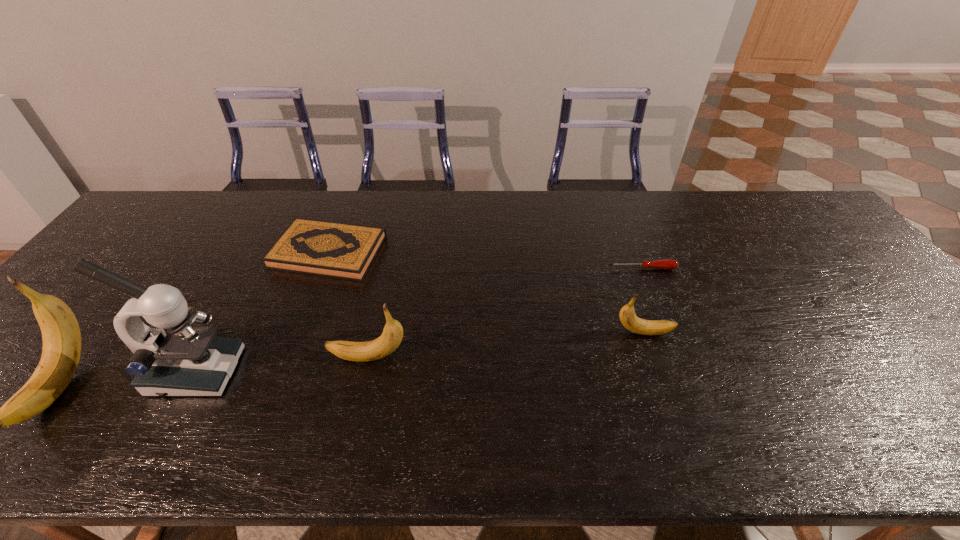
The height and width of the screenshot is (540, 960). Identify the location of unoccupied area between the screwdriver and the fourth nearest object. (643, 300).

Find the location of a particular element. The width and height of the screenshot is (960, 540). vacant area that lies between the rightmost banana and the microscope is located at coordinates coord(420,352).

I want to click on vacant space that is in between the hardback book and the rightmost banana, so click(x=486, y=292).

Identify which object is the fourth nearest to the shortest object. Please provide its 2D coordinates. Your answer should be formatted as a tuple, i.e. [(x, y)], where the tuple contains the x and y coordinates of a point satisfying the conditions above.

[(172, 358)]

The image size is (960, 540). In order to click on the second closest object to the shortest object in this screenshot , I will do `click(392, 335)`.

Find the location of a particular element. The width and height of the screenshot is (960, 540). banana identified as the second closest to the fifth shortest object is located at coordinates (628, 318).

Image resolution: width=960 pixels, height=540 pixels. Identify the location of banana that stands as the second closest to the shortest object. (392, 335).

You are a GUI agent. You are given a task and a screenshot of the screen. Output one action in this format:
    pyautogui.click(x=<x>, y=<y>)
    Task: Click on the vacant space that satisfies the following two spatial constraints: 1. on the front side of the shortest object; 2. at the start of the peel on the second shortest banana
    
    Given the screenshot: What is the action you would take?
    pyautogui.click(x=677, y=358)

The width and height of the screenshot is (960, 540). I want to click on free region that satisfies the following two spatial constraints: 1. at the start of the peel on the second shortest banana; 2. at the start of the peel on the fifth shortest object, so click(x=362, y=386).